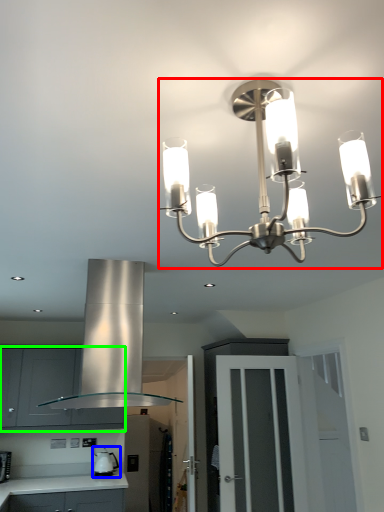
Question: Which is farther away from lamp (highlighted by a red box)? appliance (highlighted by a blue box) or cabinetry (highlighted by a green box)?

Choices:
 (A) appliance
 (B) cabinetry

Answer: (A)